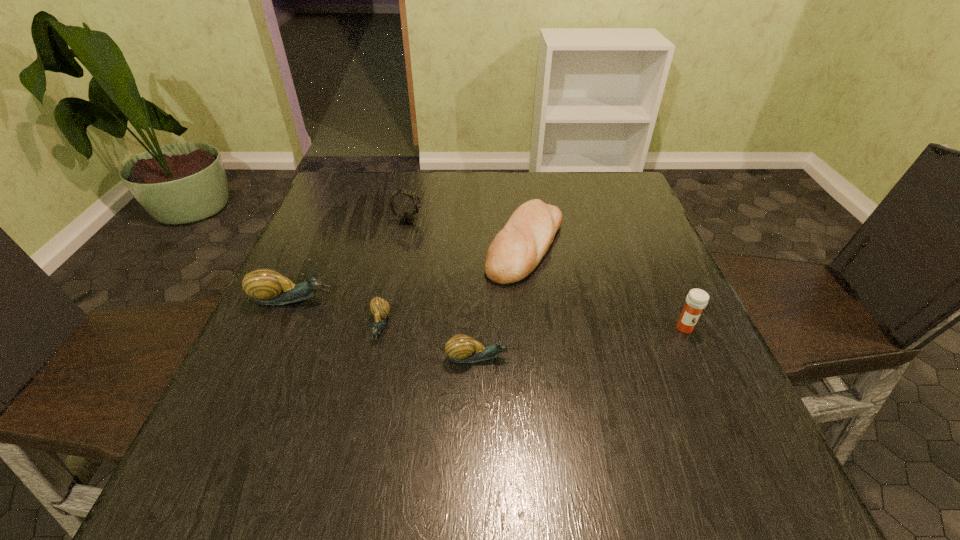
Image resolution: width=960 pixels, height=540 pixels. What are the coordinates of `the leftmost object` in the screenshot? It's located at (268, 287).

Locate an element on the screen. the tallest escargot is located at coordinates (268, 287).

Locate an element on the screen. This screenshot has width=960, height=540. the second escargot from right to left is located at coordinates (380, 308).

Identify the location of the shortest escargot. The image size is (960, 540). (380, 308).

Find the location of a particular element. This screenshot has height=540, width=960. the rightmost escargot is located at coordinates (461, 348).

Find the location of a particular element. the nearest object is located at coordinates (461, 348).

This screenshot has width=960, height=540. Find the location of `watch`. watch is located at coordinates (405, 218).

Image resolution: width=960 pixels, height=540 pixels. I want to click on bread, so click(517, 249).

I want to click on the rightmost object, so click(697, 299).

Where is `vacant space located on the front-facing side of the tallest escargot`? Image resolution: width=960 pixels, height=540 pixels. vacant space located on the front-facing side of the tallest escargot is located at coordinates (375, 300).